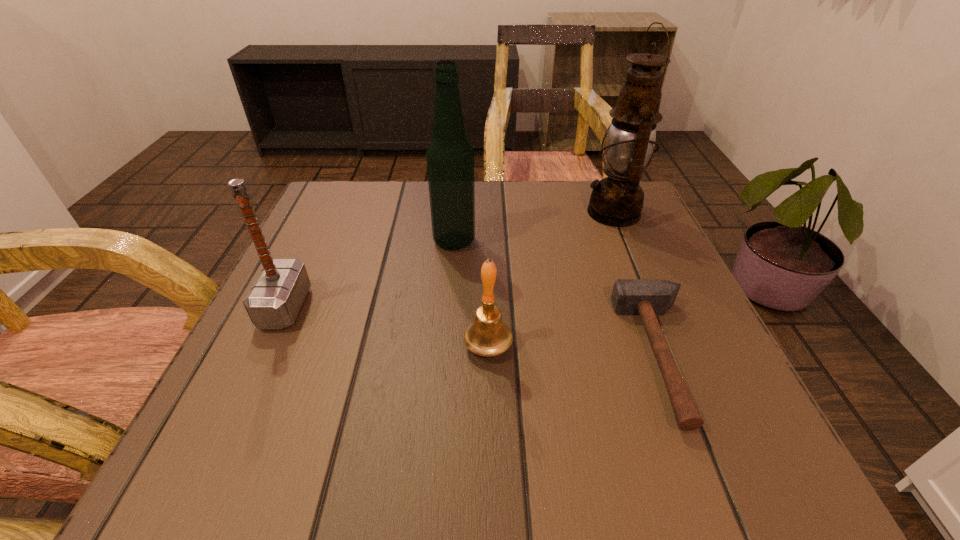
The height and width of the screenshot is (540, 960). I want to click on oil lamp, so click(617, 200).

Image resolution: width=960 pixels, height=540 pixels. What are the coordinates of `alcohol` in the screenshot? It's located at (450, 157).

Where is `the third tallest object`? The width and height of the screenshot is (960, 540). the third tallest object is located at coordinates (274, 300).

At what (x,y) coordinates should I click in order to perform the action: click on the left hammer. Please return your answer as a coordinate pair (x, y). Looking at the image, I should click on (274, 300).

This screenshot has height=540, width=960. I want to click on bell, so click(x=487, y=336).

The width and height of the screenshot is (960, 540). I want to click on the right hammer, so click(x=646, y=297).

This screenshot has height=540, width=960. I want to click on the shortest object, so click(646, 297).

The image size is (960, 540). What are the coordinates of `free space located 0.250m on the left of the oil lamp` in the screenshot? It's located at (477, 213).

Where is `free space located 0.270m on the right of the alcohol`? Image resolution: width=960 pixels, height=540 pixels. free space located 0.270m on the right of the alcohol is located at coordinates (603, 241).

Locate an element on the screen. vacant position located on the striking surface of the taller hammer is located at coordinates (440, 308).